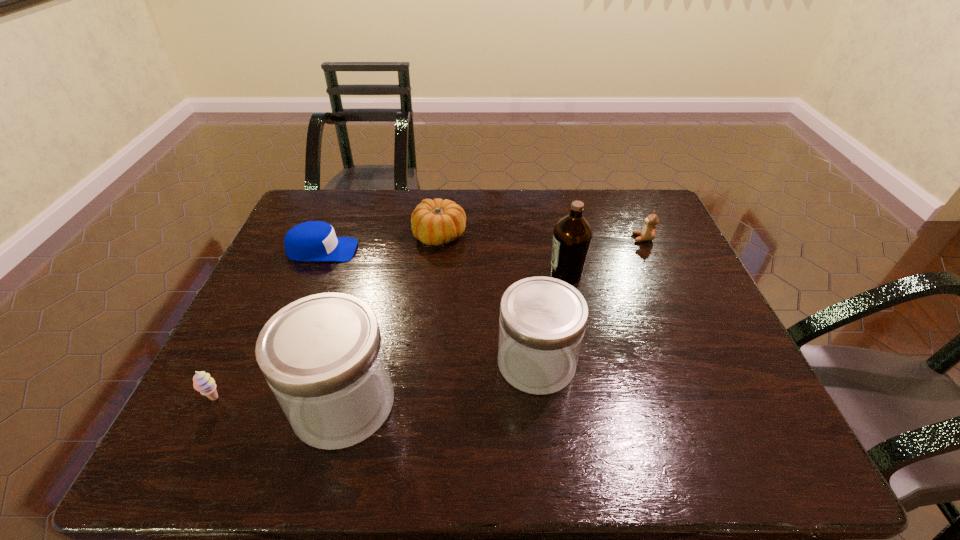
At what (x,y) coordinates should I click in order to perform the action: click on the taller jar. Please return your answer as a coordinate pair (x, y). This screenshot has height=540, width=960. Looking at the image, I should click on (323, 357).

In order to click on the right jar in this screenshot , I will do `click(542, 321)`.

At what (x,y) coordinates should I click in order to perform the action: click on the fifth shortest object. Please return your answer as a coordinate pair (x, y). The image size is (960, 540). Looking at the image, I should click on (542, 321).

Locate an element on the screen. This screenshot has width=960, height=540. gourd is located at coordinates (436, 222).

Locate an element on the screen. teddy bear is located at coordinates (648, 232).

Locate an element on the screen. The height and width of the screenshot is (540, 960). baseball cap is located at coordinates (314, 240).

Find the location of a particular element. The image size is (960, 540). olive oil is located at coordinates (572, 235).

Locate an element on the screen. This screenshot has width=960, height=540. sherbert is located at coordinates (202, 382).

Find the location of a particular element. vacant area situated on the right of the left jar is located at coordinates (456, 403).

At what (x,y) coordinates should I click in order to perform the action: click on vacant space positioned 0.160m on the back of the right jar. Please return your answer as a coordinate pair (x, y). The width and height of the screenshot is (960, 540). Looking at the image, I should click on (528, 287).